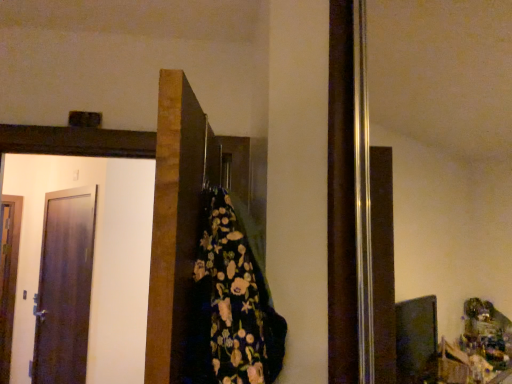
The height and width of the screenshot is (384, 512). Describe the element at coordinates (8, 277) in the screenshot. I see `wooden door at left, acting as the third door starting from the right` at that location.

Locate an element on the screen. The width and height of the screenshot is (512, 384). floral-patterned fabric at center is located at coordinates (231, 305).

Is dark brown wooden door at center, which is counted as the first door, starting from the front, not inside wooden door at left, which is the 1th door from left to right?

Yes.

In terms of width, does dark brown wooden door at center, arranged as the 1th door when viewed from the right, look wider or thinner when compared to wooden door at left, arranged as the 1th door when viewed from the back?

Clearly, dark brown wooden door at center, arranged as the 1th door when viewed from the right, has more width compared to wooden door at left, arranged as the 1th door when viewed from the back.

Which object is further away from the camera taking this photo, dark brown wooden door at center, which is counted as the first door, starting from the front, or wooden door at left, acting as the third door starting from the right?

wooden door at left, acting as the third door starting from the right, is further from the camera.

Is dark brown wooden door at center, which is counted as the first door, starting from the front, facing away from wooden door at left, which is the 1th door from left to right?

No, dark brown wooden door at center, which is counted as the first door, starting from the front,'s orientation is not away from wooden door at left, which is the 1th door from left to right.

Considering the sizes of objects wooden door at left, arranged as the 1th door when viewed from the back, and matte dark brown door at left, the 2th door when ordered from right to left, in the image provided, who is bigger, wooden door at left, arranged as the 1th door when viewed from the back, or matte dark brown door at left, the 2th door when ordered from right to left,?

matte dark brown door at left, the 2th door when ordered from right to left.

You are a GUI agent. You are given a task and a screenshot of the screen. Output one action in this format:
    pyautogui.click(x=<x>, y=<y>)
    Task: Click on the 1st door in front of the wooden door at left, arranged as the 1th door when viewed from the back
    This screenshot has width=512, height=384.
    Given the screenshot: What is the action you would take?
    pos(64,287)

Looking at this image, is matte dark brown door at left, placed as the 2th door when sorted from front to back, a part of wooden door at left, acting as the 3th door starting from the front?

No, matte dark brown door at left, placed as the 2th door when sorted from front to back, is not surrounded by wooden door at left, acting as the 3th door starting from the front.

Are wooden door at left, arranged as the 1th door when viewed from the back, and matte dark brown door at left, acting as the 2th door starting from the back, beside each other?

No, wooden door at left, arranged as the 1th door when viewed from the back, is not beside matte dark brown door at left, acting as the 2th door starting from the back.

Does dark brown wooden door at center, arranged as the 1th door when viewed from the right, have a greater height compared to matte dark brown door at left, acting as the 2th door starting from the back?

Incorrect, the height of dark brown wooden door at center, arranged as the 1th door when viewed from the right, is not larger of that of matte dark brown door at left, acting as the 2th door starting from the back.

Is dark brown wooden door at center, which is counted as the first door, starting from the front, looking in the opposite direction of matte dark brown door at left, acting as the 2th door starting from the back?

No, dark brown wooden door at center, which is counted as the first door, starting from the front, is not facing away from matte dark brown door at left, acting as the 2th door starting from the back.

Is the surface of dark brown wooden door at center, the 3th door positioned from the back, in direct contact with matte dark brown door at left, the 2th door when ordered from right to left?

No, dark brown wooden door at center, the 3th door positioned from the back, is not next to matte dark brown door at left, the 2th door when ordered from right to left.

Which object is closer to the camera, dark brown wooden door at center, which is counted as the first door, starting from the front, or matte dark brown door at left, placed as the 2th door when sorted from front to back?

dark brown wooden door at center, which is counted as the first door, starting from the front, is more forward.

Would you say wooden door at left, which is the 1th door from left to right, contains dark brown wooden door at center, which is counted as the first door, starting from the front?

Actually, dark brown wooden door at center, which is counted as the first door, starting from the front, is outside wooden door at left, which is the 1th door from left to right.

What's the angular difference between wooden door at left, acting as the 3th door starting from the front, and dark brown wooden door at center, the 3th door positioned from the back,'s facing directions?

The facing directions of wooden door at left, acting as the 3th door starting from the front, and dark brown wooden door at center, the 3th door positioned from the back, are 58.8 degrees apart.

Is wooden door at left, which is the 1th door from left to right, thinner than dark brown wooden door at center, arranged as the 1th door when viewed from the right?

Yes.

Looking at this image, are wooden door at left, which is the 1th door from left to right, and floral-patterned fabric at center located far from each other?

Yes, wooden door at left, which is the 1th door from left to right, and floral-patterned fabric at center are located far from each other.

Could you tell me if wooden door at left, which is the 1th door from left to right, is facing floral-patterned fabric at center?

No, wooden door at left, which is the 1th door from left to right, is not aimed at floral-patterned fabric at center.

From the picture: Is wooden door at left, acting as the third door starting from the right, to the left or to the right of floral-patterned fabric at center in the image?

wooden door at left, acting as the third door starting from the right, is to the left of floral-patterned fabric at center.

Is wooden door at left, arranged as the 1th door when viewed from the back, inside the boundaries of floral-patterned fabric at center, or outside?

wooden door at left, arranged as the 1th door when viewed from the back, is not inside floral-patterned fabric at center, it's outside.

From a real-world perspective, is dark brown wooden door at center, arranged as the 1th door when viewed from the right, physically below floral-patterned fabric at center?

Incorrect, from a real-world perspective, dark brown wooden door at center, arranged as the 1th door when viewed from the right, is higher than floral-patterned fabric at center.

Which is more to the left, dark brown wooden door at center, which is counted as the first door, starting from the front, or floral-patterned fabric at center?

dark brown wooden door at center, which is counted as the first door, starting from the front.

In the scene shown: How different are the orientations of dark brown wooden door at center, arranged as the 1th door when viewed from the right, and floral-patterned fabric at center in degrees?

179 degrees.

Measure the distance between dark brown wooden door at center, the 3th door positioned from the back, and floral-patterned fabric at center.

5.26 inches.

From the image's perspective, does floral-patterned fabric at center appear higher than dark brown wooden door at center, arranged as the 1th door when viewed from the right?

No, from the image's perspective, floral-patterned fabric at center is not on top of dark brown wooden door at center, arranged as the 1th door when viewed from the right.

Is floral-patterned fabric at center at the right side of dark brown wooden door at center, arranged as the 1th door when viewed from the right?

Yes, floral-patterned fabric at center is to the right of dark brown wooden door at center, arranged as the 1th door when viewed from the right.

Does floral-patterned fabric at center have a smaller size compared to dark brown wooden door at center, arranged as the 3th door when viewed from the left?

Indeed, floral-patterned fabric at center has a smaller size compared to dark brown wooden door at center, arranged as the 3th door when viewed from the left.

In terms of width, does floral-patterned fabric at center look wider or thinner when compared to dark brown wooden door at center, arranged as the 3th door when viewed from the left?

In the image, floral-patterned fabric at center appears to be wider than dark brown wooden door at center, arranged as the 3th door when viewed from the left.

Where is `door that is the 2nd one when counting upward from the wooden door at left, acting as the third door starting from the right (from the image's perspective)`? door that is the 2nd one when counting upward from the wooden door at left, acting as the third door starting from the right (from the image's perspective) is located at coordinates (176, 221).

Where is `the 1st door to the right of the wooden door at left, arranged as the 1th door when viewed from the back, counting from the anchor's position`? the 1st door to the right of the wooden door at left, arranged as the 1th door when viewed from the back, counting from the anchor's position is located at coordinates (64, 287).

When comparing their distances from wooden door at left, acting as the third door starting from the right, does dark brown wooden door at center, arranged as the 1th door when viewed from the right, or matte dark brown door at left, placed as the 2th door when sorted from front to back, seem closer?

matte dark brown door at left, placed as the 2th door when sorted from front to back, is closer to wooden door at left, acting as the third door starting from the right.

Consider the image. Estimate the real-world distances between objects in this image. Which object is closer to matte dark brown door at left, arranged as the 2th door when viewed from the left, floral-patterned fabric at center or dark brown wooden door at center, arranged as the 3th door when viewed from the left?

Based on the image, dark brown wooden door at center, arranged as the 3th door when viewed from the left, appears to be nearer to matte dark brown door at left, arranged as the 2th door when viewed from the left.

Based on the photo, when comparing their distances from wooden door at left, arranged as the 1th door when viewed from the back, does dark brown wooden door at center, which is counted as the first door, starting from the front, or floral-patterned fabric at center seem closer?

Based on the image, dark brown wooden door at center, which is counted as the first door, starting from the front, appears to be nearer to wooden door at left, arranged as the 1th door when viewed from the back.

From the image, which object appears to be farther from dark brown wooden door at center, arranged as the 3th door when viewed from the left, matte dark brown door at left, acting as the 2th door starting from the back, or wooden door at left, which is the 1th door from left to right?

wooden door at left, which is the 1th door from left to right.

Based on their spatial positions, is dark brown wooden door at center, which is counted as the first door, starting from the front, or wooden door at left, arranged as the 1th door when viewed from the back, further from matte dark brown door at left, the 2th door when ordered from right to left?

dark brown wooden door at center, which is counted as the first door, starting from the front, is further to matte dark brown door at left, the 2th door when ordered from right to left.

Looking at the image, which one is located further to matte dark brown door at left, acting as the 2th door starting from the back, wooden door at left, arranged as the 1th door when viewed from the back, or floral-patterned fabric at center?

floral-patterned fabric at center is positioned further to the anchor matte dark brown door at left, acting as the 2th door starting from the back.

Looking at the image, which one is located closer to floral-patterned fabric at center, matte dark brown door at left, acting as the 2th door starting from the back, or dark brown wooden door at center, arranged as the 1th door when viewed from the right?

The object closer to floral-patterned fabric at center is dark brown wooden door at center, arranged as the 1th door when viewed from the right.

Looking at the image, which one is located further to wooden door at left, acting as the 3th door starting from the front, floral-patterned fabric at center or matte dark brown door at left, arranged as the 2th door when viewed from the left?

floral-patterned fabric at center is further to wooden door at left, acting as the 3th door starting from the front.

The height and width of the screenshot is (384, 512). Find the location of `door positioned between floral-patterned fabric at center and wooden door at left, acting as the 3th door starting from the front, from near to far`. door positioned between floral-patterned fabric at center and wooden door at left, acting as the 3th door starting from the front, from near to far is located at coordinates coord(64,287).

The image size is (512, 384). Identify the location of door between dark brown wooden door at center, arranged as the 3th door when viewed from the left, and wooden door at left, which is the 1th door from left to right, along the z-axis. (64, 287).

At what (x,y) coordinates should I click in order to perform the action: click on blanket located between dark brown wooden door at center, the 3th door positioned from the back, and wooden door at left, which is the 1th door from left to right, in the depth direction. Please return your answer as a coordinate pair (x, y). This screenshot has width=512, height=384. Looking at the image, I should click on (231, 305).

At what (x,y) coordinates should I click in order to perform the action: click on blanket positioned between dark brown wooden door at center, arranged as the 1th door when viewed from the right, and matte dark brown door at left, the 2th door when ordered from right to left, from near to far. Please return your answer as a coordinate pair (x, y). The width and height of the screenshot is (512, 384). Looking at the image, I should click on [231, 305].